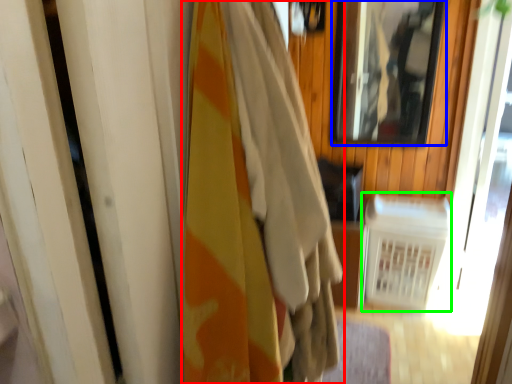
Question: Considering the real-world distances, which object is farthest from curtain (highlighted by a red box)? mirror (highlighted by a blue box) or radiator (highlighted by a green box)?

Choices:
 (A) mirror
 (B) radiator

Answer: (A)